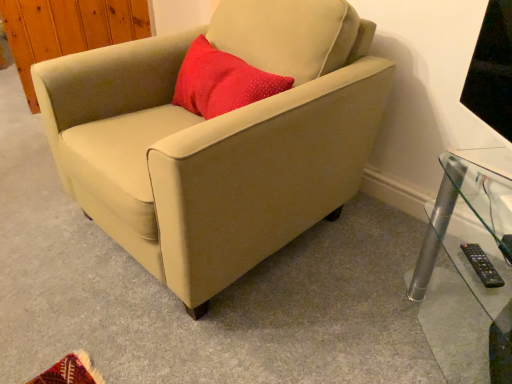
Question: Is black plastic remote at lower right far from clear glass table at lower right?

Choices:
 (A) yes
 (B) no

Answer: (B)

Question: Considering the relative positions of black plastic remote at lower right and clear glass table at lower right in the image provided, is black plastic remote at lower right to the right of clear glass table at lower right from the viewer's perspective?

Choices:
 (A) no
 (B) yes

Answer: (A)

Question: Considering the relative sizes of black plastic remote at lower right and clear glass table at lower right in the image provided, is black plastic remote at lower right bigger than clear glass table at lower right?

Choices:
 (A) yes
 (B) no

Answer: (B)

Question: Is the position of black plastic remote at lower right more distant than that of clear glass table at lower right?

Choices:
 (A) yes
 (B) no

Answer: (A)

Question: From the image's perspective, is black plastic remote at lower right located beneath clear glass table at lower right?

Choices:
 (A) yes
 (B) no

Answer: (B)

Question: Considering the relative positions of black plastic remote at lower right and clear glass table at lower right in the image provided, is black plastic remote at lower right to the left of clear glass table at lower right from the viewer's perspective?

Choices:
 (A) no
 (B) yes

Answer: (B)

Question: Is black plastic remote at lower right not within beige fabric chair at center?

Choices:
 (A) yes
 (B) no

Answer: (A)

Question: Is black plastic remote at lower right further to the viewer compared to beige fabric chair at center?

Choices:
 (A) yes
 (B) no

Answer: (A)

Question: Is black plastic remote at lower right wider than beige fabric chair at center?

Choices:
 (A) no
 (B) yes

Answer: (A)

Question: Is black plastic remote at lower right positioned far away from beige fabric chair at center?

Choices:
 (A) no
 (B) yes

Answer: (A)

Question: Is black plastic remote at lower right smaller than beige fabric chair at center?

Choices:
 (A) no
 (B) yes

Answer: (B)

Question: Can you confirm if black plastic remote at lower right is shorter than beige fabric chair at center?

Choices:
 (A) yes
 (B) no

Answer: (A)

Question: From the image's perspective, is clear glass table at lower right located above black plastic remote at lower right?

Choices:
 (A) yes
 (B) no

Answer: (B)